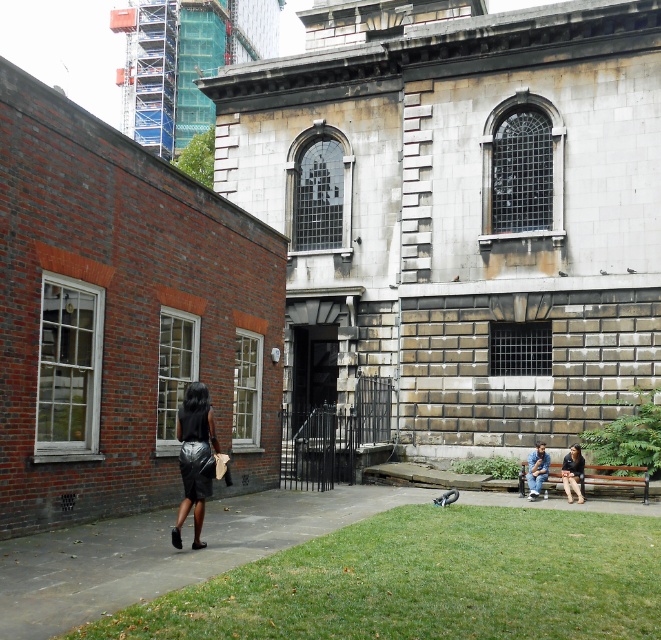
You are a gardener who wants to mow the green grass at lower center and the blue denim jeans at lower right. Which area requires more attention to ensure proper mowing? Explain your reasoning based on their heights.

The blue denim jeans at lower right requires more attention because it has a greater height than the green grass at lower center, so it may need a closer cut to maintain evenness.